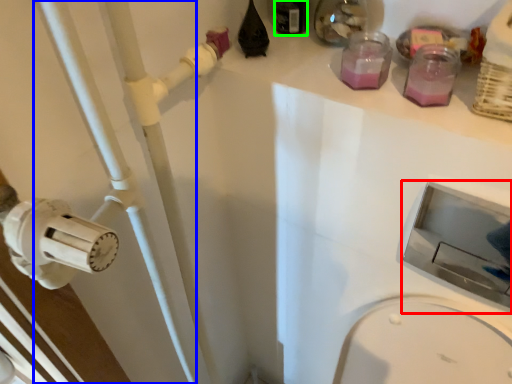
Question: Which object is the farthest from sink (highlighted by a red box)? Choose among these: pipe (highlighted by a blue box) or bottle (highlighted by a green box).

Choices:
 (A) pipe
 (B) bottle

Answer: (B)